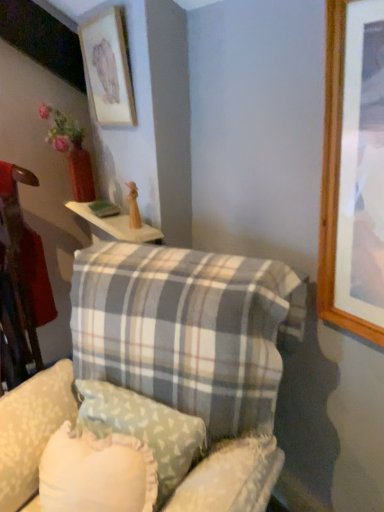
Question: Considering the relative sizes of plaid fabric pillow at center, the first pillow positioned from the front, and plaid fabric swivel chair at lower center in the image provided, is plaid fabric pillow at center, the first pillow positioned from the front, thinner than plaid fabric swivel chair at lower center?

Choices:
 (A) no
 (B) yes

Answer: (A)

Question: From the image's perspective, does plaid fabric pillow at center, positioned as the 2th pillow in back-to-front order, appear higher than plaid fabric swivel chair at lower center?

Choices:
 (A) yes
 (B) no

Answer: (A)

Question: Can you confirm if plaid fabric pillow at center, positioned as the 2th pillow in back-to-front order, is bigger than plaid fabric swivel chair at lower center?

Choices:
 (A) yes
 (B) no

Answer: (A)

Question: Would you say plaid fabric pillow at center, positioned as the 2th pillow in back-to-front order, contains plaid fabric swivel chair at lower center?

Choices:
 (A) no
 (B) yes

Answer: (B)

Question: Does plaid fabric pillow at center, the first pillow positioned from the front, come in front of plaid fabric swivel chair at lower center?

Choices:
 (A) no
 (B) yes

Answer: (B)

Question: Is white wood table at upper center bigger or smaller than plaid fabric swivel chair at lower center?

Choices:
 (A) small
 (B) big

Answer: (A)

Question: Is white wood table at upper center inside or outside of plaid fabric swivel chair at lower center?

Choices:
 (A) inside
 (B) outside

Answer: (B)

Question: In the image, is white wood table at upper center positioned in front of or behind plaid fabric swivel chair at lower center?

Choices:
 (A) behind
 (B) front

Answer: (A)

Question: Considering the positions of point (91, 215) and point (223, 464), is point (91, 215) closer or farther from the camera than point (223, 464)?

Choices:
 (A) closer
 (B) farther

Answer: (B)

Question: Is matte wooden picture frame at upper left inside or outside of white wood table at upper center?

Choices:
 (A) outside
 (B) inside

Answer: (A)

Question: Is matte wooden picture frame at upper left bigger or smaller than white wood table at upper center?

Choices:
 (A) big
 (B) small

Answer: (A)

Question: Would you say matte wooden picture frame at upper left is to the left or to the right of white wood table at upper center in the picture?

Choices:
 (A) left
 (B) right

Answer: (B)

Question: Considering the positions of matte wooden picture frame at upper left and white wood table at upper center in the image, is matte wooden picture frame at upper left wider or thinner than white wood table at upper center?

Choices:
 (A) thin
 (B) wide

Answer: (A)

Question: Is plaid fabric pillow at center, the first pillow positioned from the front, wider or thinner than matte wooden picture frame at upper left?

Choices:
 (A) thin
 (B) wide

Answer: (B)

Question: Considering the positions of plaid fabric pillow at center, positioned as the 2th pillow in back-to-front order, and matte wooden picture frame at upper left in the image, is plaid fabric pillow at center, positioned as the 2th pillow in back-to-front order, taller or shorter than matte wooden picture frame at upper left?

Choices:
 (A) tall
 (B) short

Answer: (A)